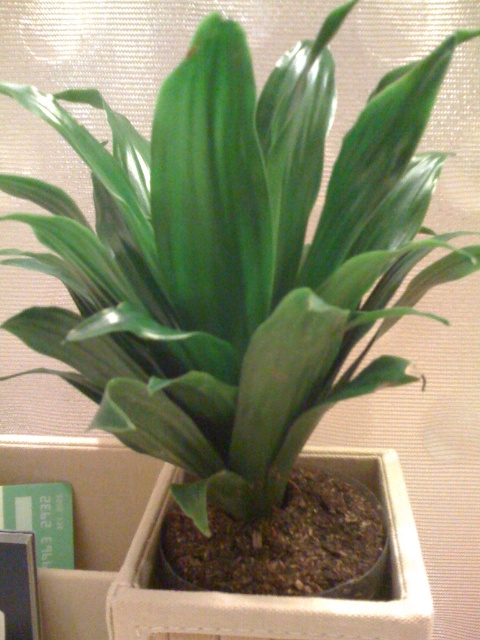
You are organizing items in a storage room and see the matte white pot at center and the green cardboard box at lower left. Which item is closer to you?

The matte white pot at center is closer to you because it is in front of the green cardboard box at lower left.

You are organizing a shelf and need to place the matte white pot at center and the green cardboard box at lower left. Based on their heights, which object should you place first if you want to stack them?

The green cardboard box at lower left should be placed first because it is taller than the matte white pot at center, allowing the shorter pot to be stacked on top.